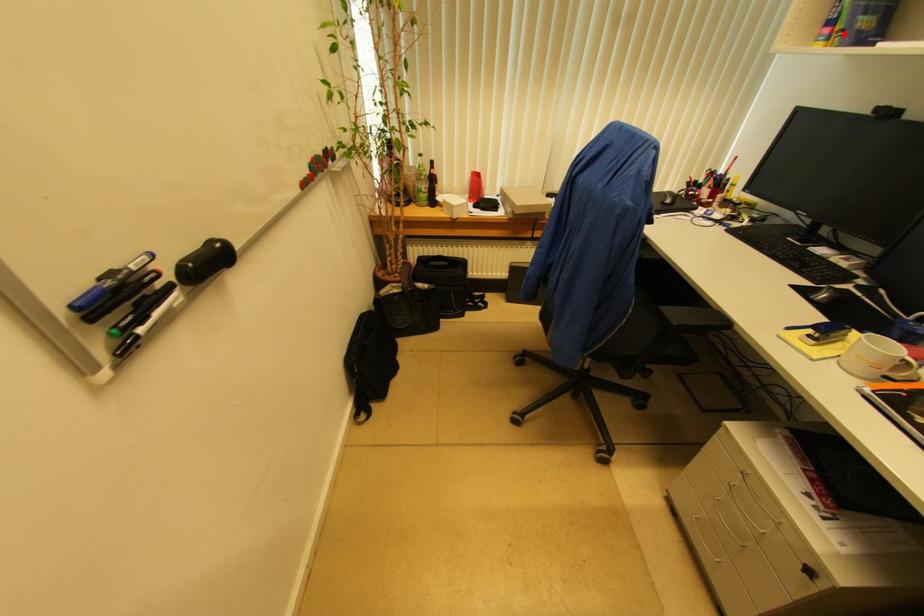
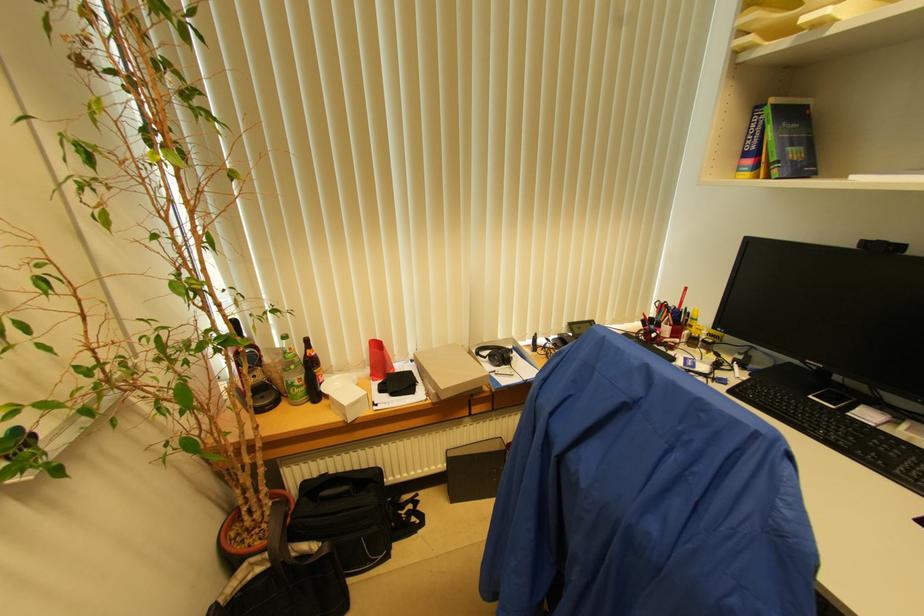
The point at the highlighted location is marked in the first image. Where is the corresponding point in the second image?

(780, 166)